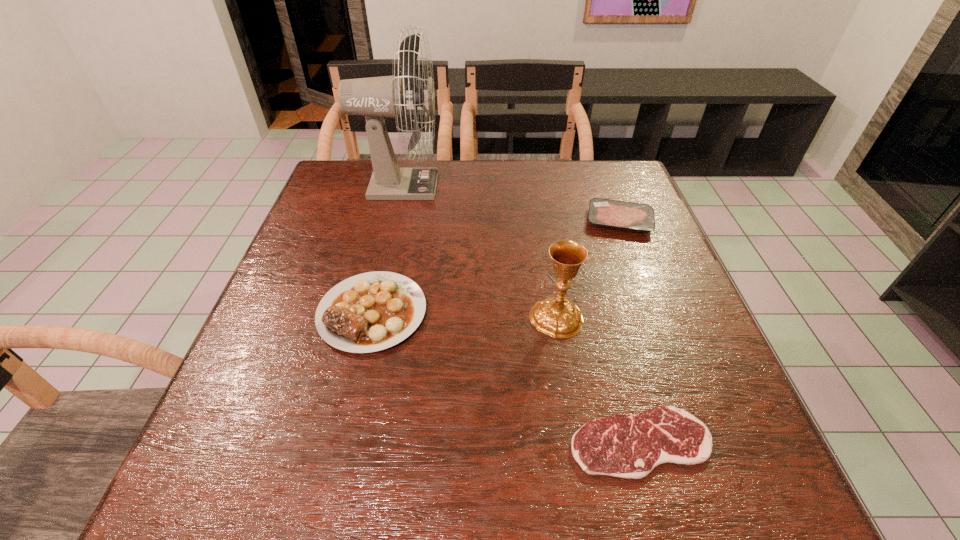
Where is `the tallest object`? Image resolution: width=960 pixels, height=540 pixels. the tallest object is located at coordinates (375, 98).

Where is `chalice`? The width and height of the screenshot is (960, 540). chalice is located at coordinates (559, 317).

Locate an element on the screen. the leftmost steak is located at coordinates (369, 312).

Identify the location of the third tallest object. The height and width of the screenshot is (540, 960). (369, 312).

This screenshot has height=540, width=960. Find the location of `the second shortest object`. the second shortest object is located at coordinates pos(628,216).

The width and height of the screenshot is (960, 540). I want to click on the farthest steak, so click(x=628, y=216).

Where is `the shortest object`? The image size is (960, 540). the shortest object is located at coordinates (628, 446).

You are a GUI agent. You are given a task and a screenshot of the screen. Output one action in this format:
    pyautogui.click(x=<x>, y=<y>)
    Task: Click on the nearest object
    
    Given the screenshot: What is the action you would take?
    pyautogui.click(x=628, y=446)

I want to click on vacant space situated 0.080m on the air flow direction of the fan, so click(x=468, y=186).

The image size is (960, 540). I want to click on free point located 0.210m on the front of the chalice, so click(576, 441).